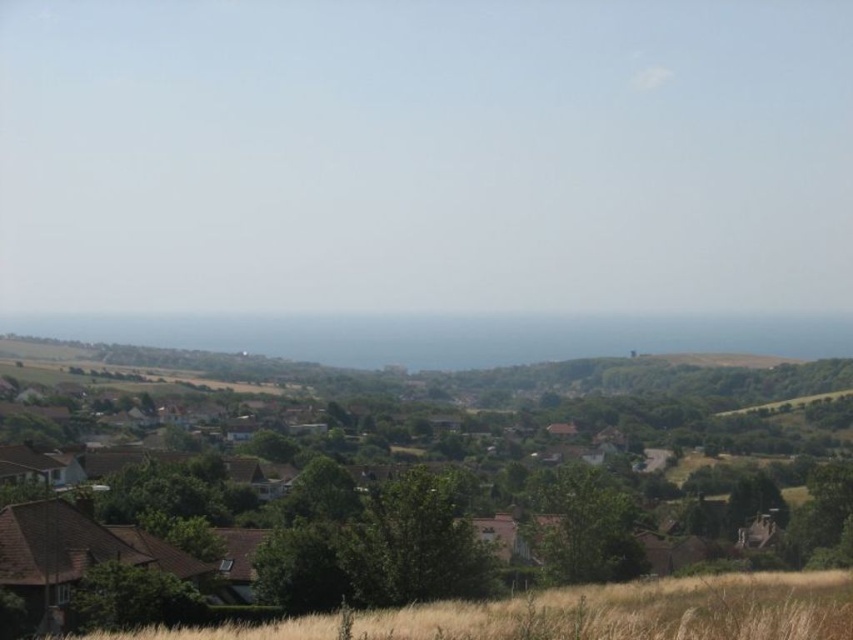
In the scene shown: Is blue ocean at center smaller than dry grass at lower center?

No, blue ocean at center is not smaller than dry grass at lower center.

Image resolution: width=853 pixels, height=640 pixels. What do you see at coordinates (454, 336) in the screenshot?
I see `blue ocean at center` at bounding box center [454, 336].

Does point (206, 320) come in front of point (775, 625)?

No, (206, 320) is further to viewer.

I want to click on blue ocean at center, so click(x=454, y=336).

Does brown wooden houses at center have a greater width compared to dry grass at lower center?

Yes, brown wooden houses at center is wider than dry grass at lower center.

Can you confirm if brown wooden houses at center is shorter than dry grass at lower center?

Incorrect, brown wooden houses at center's height does not fall short of dry grass at lower center's.

Is point (137, 592) more distant than point (589, 616)?

Yes, point (137, 592) is behind point (589, 616).

Where is `brown wooden houses at center`? The width and height of the screenshot is (853, 640). brown wooden houses at center is located at coordinates (390, 538).

Is brown wooden houses at center shorter than blue ocean at center?

No.

Is brown wooden houses at center taller than blue ocean at center?

Indeed, brown wooden houses at center has a greater height compared to blue ocean at center.

Locate an element on the screen. The height and width of the screenshot is (640, 853). brown wooden houses at center is located at coordinates (390, 538).